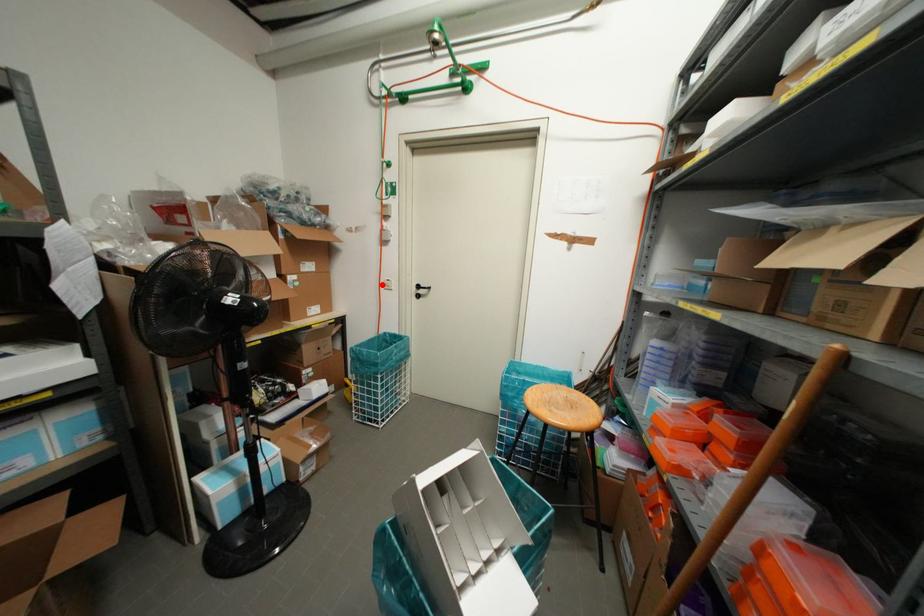
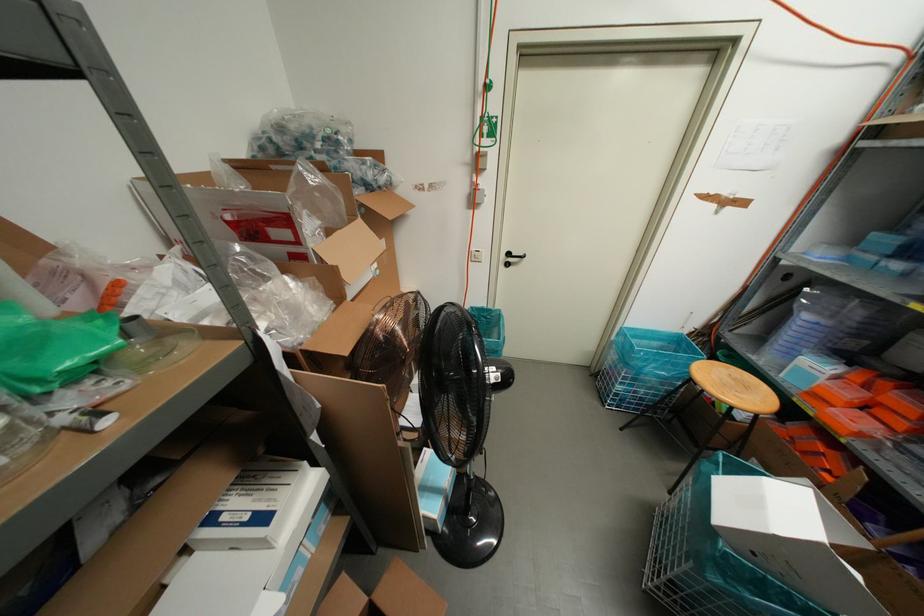
Find the pixel in the second image that matches the highlighted location in the first image.

(470, 257)